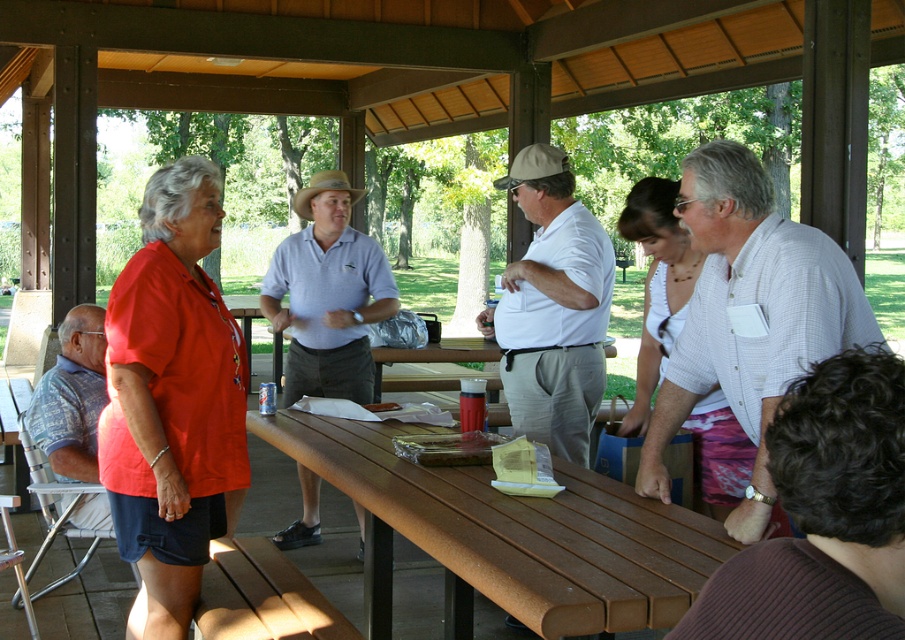
Question: Is brown wood picnic table at center positioned in front of white checkered shirt at center?

Choices:
 (A) no
 (B) yes

Answer: (B)

Question: Among these objects, which one is farthest from the camera?

Choices:
 (A) brown wood picnic table at center
 (B) white checkered shirt at center

Answer: (B)

Question: Can you confirm if white checkered shirt at center is positioned to the left of matte white shirt at center?

Choices:
 (A) yes
 (B) no

Answer: (B)

Question: Does brown wood picnic table at center have a lesser width compared to white checkered shirt at center?

Choices:
 (A) yes
 (B) no

Answer: (B)

Question: Which point is closer to the camera?

Choices:
 (A) (816, 294)
 (B) (525, 212)
 (C) (62, 413)
 (D) (703, 529)

Answer: (A)

Question: Which point is farther to the camera?

Choices:
 (A) matte white shirt at center
 (B) brown wood picnic table at center
 (C) white checkered shirt at center

Answer: (A)